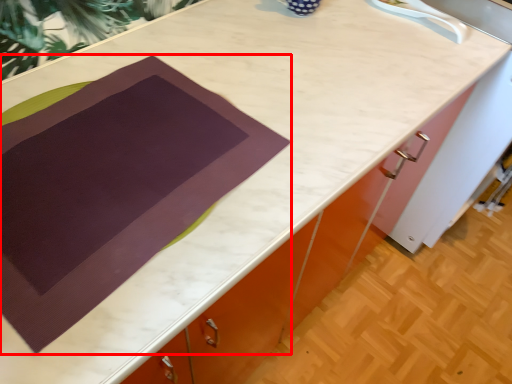
Question: Observing the image, what is the correct spatial positioning of blanket (annotated by the red box) in reference to sink?

Choices:
 (A) right
 (B) left

Answer: (B)